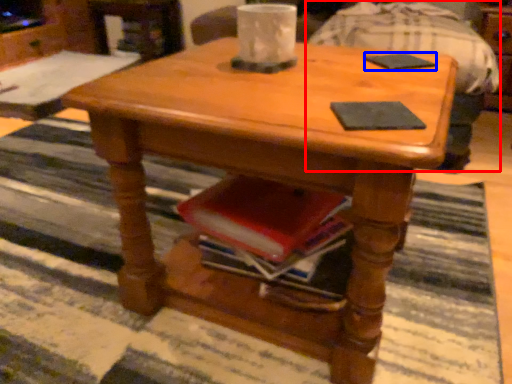
Question: Among these objects, which one is nearest to the camera, swivel chair (highlighted by a red box) or pad (highlighted by a blue box)?

Choices:
 (A) swivel chair
 (B) pad

Answer: (B)